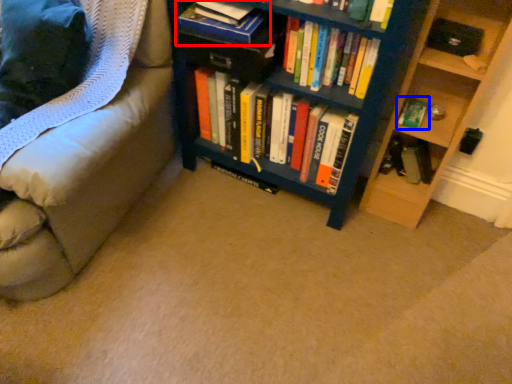
Question: Which of the following is the farthest to the observer, book (highlighted by a red box) or book (highlighted by a blue box)?

Choices:
 (A) book
 (B) book

Answer: (B)